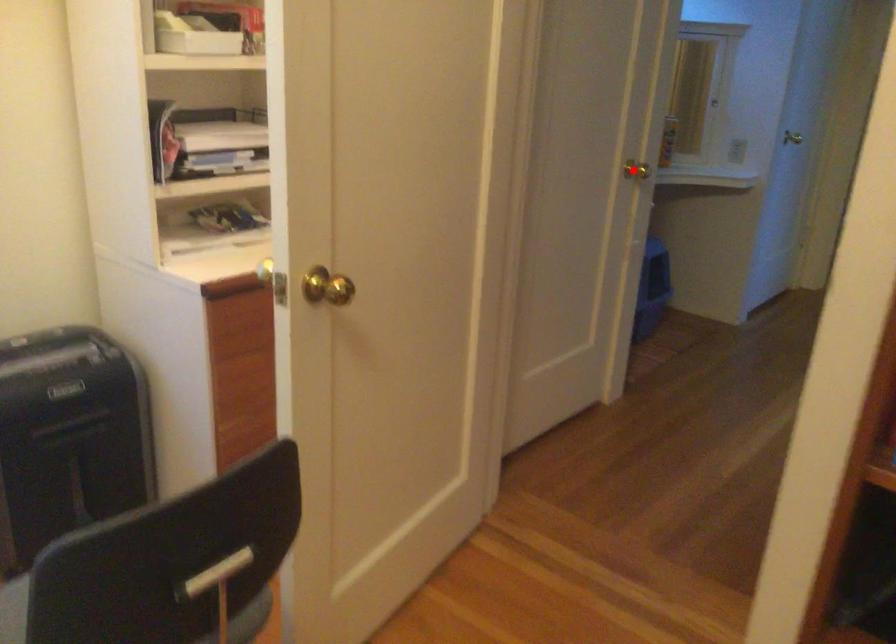
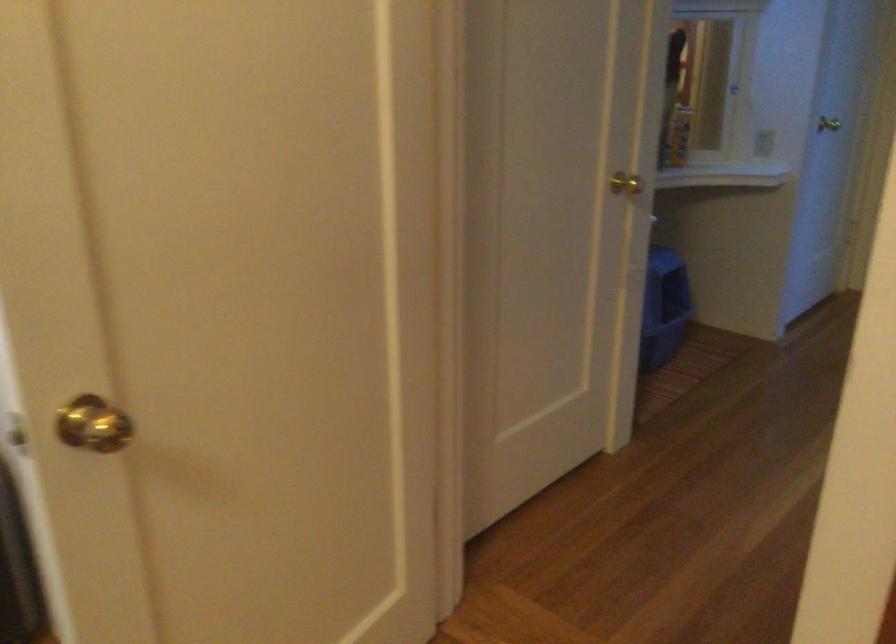
Question: I am providing you with two images of the same scene from different viewpoints. Given a red point in image1, look at the same physical point in image2. Is it:

Choices:
 (A) Closer to the viewpoint
 (B) Farther from the viewpoint

Answer: (A)